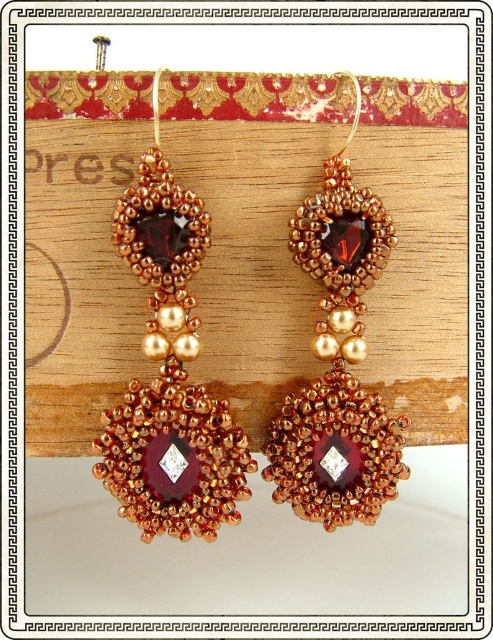
Can you confirm if matte gold earrings at center is positioned below copper beaded earring at center?

Yes.

Does point (163, 417) lie behind point (351, 256)?

No, (163, 417) is closer to viewer.

Identify the location of matte gold earrings at center. (170, 374).